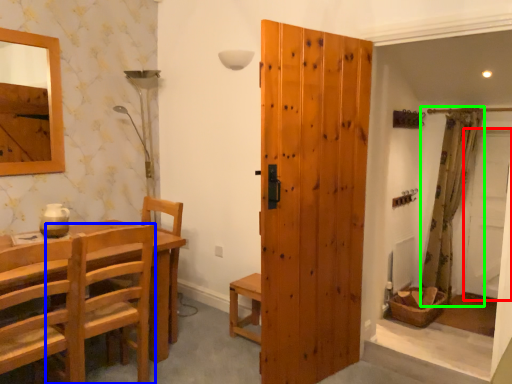
Question: Which object is the closest to the screen door (highlighted by a red box)? Choose among these: chair (highlighted by a blue box) or curtain (highlighted by a green box).

Choices:
 (A) chair
 (B) curtain

Answer: (B)